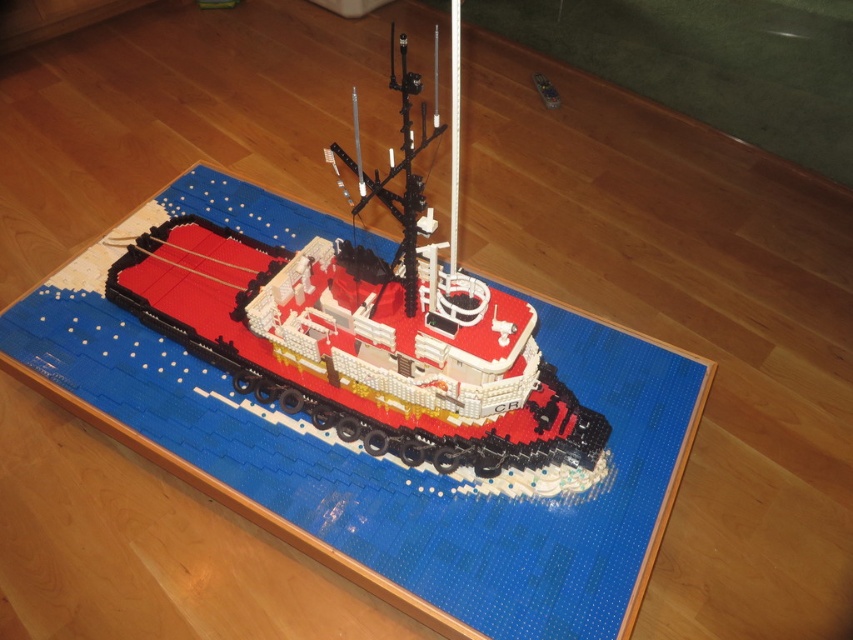
Is blue plastic mat at center to the right of brick red plastic boat at center from the viewer's perspective?

No, blue plastic mat at center is not to the right of brick red plastic boat at center.

Which is below, blue plastic mat at center or brick red plastic boat at center?

blue plastic mat at center

At what (x,y) coordinates should I click in order to perform the action: click on blue plastic mat at center. Please return your answer as a coordinate pair (x, y). The width and height of the screenshot is (853, 640). Looking at the image, I should click on 376,424.

Image resolution: width=853 pixels, height=640 pixels. Find the location of `blue plastic mat at center`. blue plastic mat at center is located at coordinates (376, 424).